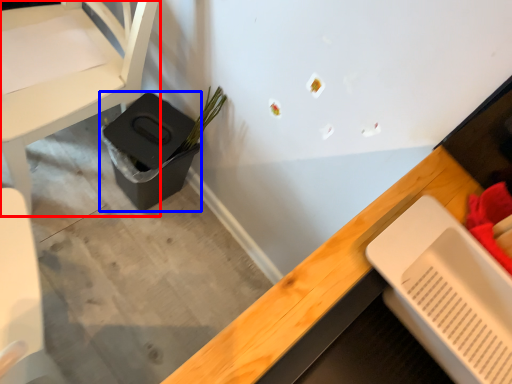
Question: Which point is further to the camera, chair (highlighted by a red box) or potty (highlighted by a blue box)?

Choices:
 (A) chair
 (B) potty

Answer: (B)